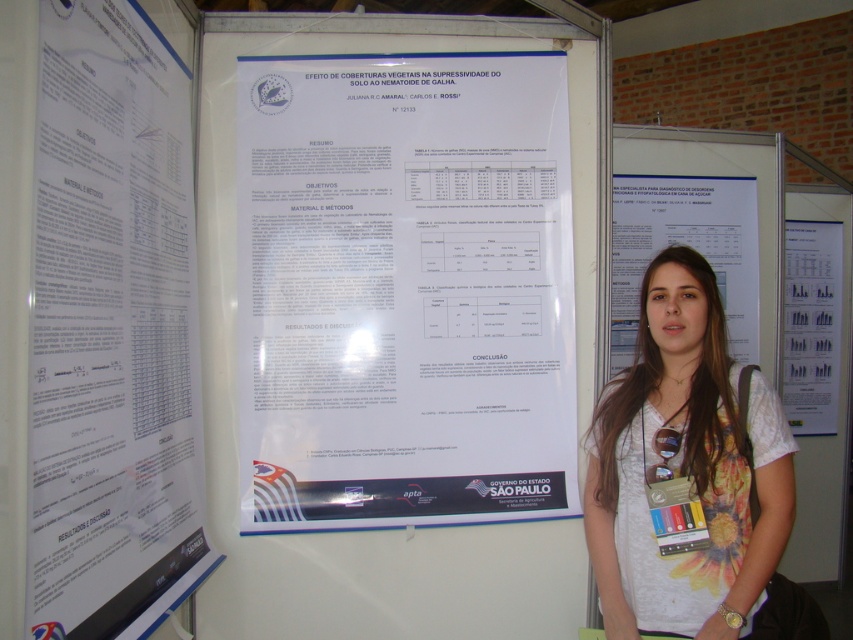
Does point (86, 60) come in front of point (624, 324)?

Yes, point (86, 60) is closer to viewer.

Based on the photo, does white paper poster at upper left appear on the right side of white paper at center?

In fact, white paper poster at upper left is to the left of white paper at center.

Locate an element on the screen. The image size is (853, 640). white paper poster at upper left is located at coordinates (112, 330).

Measure the distance between white paper poster at center and camera.

white paper poster at center is 1.76 meters away from camera.

Who is lower down, white paper poster at center or white paper at center?

white paper poster at center is lower down.

The image size is (853, 640). In order to click on white paper poster at center in this screenshot , I will do `click(404, 291)`.

At what (x,y) coordinates should I click in order to perform the action: click on white paper poster at center. Please return your answer as a coordinate pair (x, y). The height and width of the screenshot is (640, 853). Looking at the image, I should click on (404, 291).

Between white floral shirt at center and white paper at right, which one appears on the right side from the viewer's perspective?

white paper at right

Who is positioned more to the left, white floral shirt at center or white paper at right?

From the viewer's perspective, white floral shirt at center appears more on the left side.

Where is `white floral shirt at center`? white floral shirt at center is located at coordinates (685, 468).